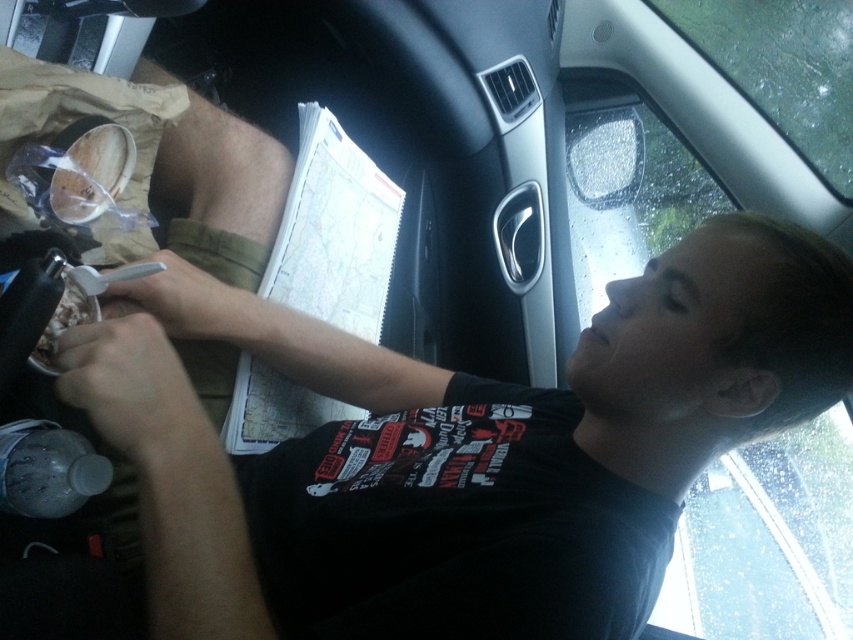
Question: Which of the following is the farthest from the observer?

Choices:
 (A) transparent glass windshield at upper right
 (B) transparent glass car window at upper right

Answer: (B)

Question: Which object appears closest to the camera in this image?

Choices:
 (A) transparent glass car window at upper right
 (B) transparent glass windshield at upper right

Answer: (B)

Question: Does transparent glass car window at upper right appear over transparent glass windshield at upper right?

Choices:
 (A) no
 (B) yes

Answer: (A)

Question: Considering the relative positions of transparent glass car window at upper right and transparent glass windshield at upper right in the image provided, where is transparent glass car window at upper right located with respect to transparent glass windshield at upper right?

Choices:
 (A) left
 (B) right

Answer: (A)

Question: Can you confirm if transparent glass car window at upper right is positioned above transparent glass windshield at upper right?

Choices:
 (A) yes
 (B) no

Answer: (B)

Question: Which object appears farthest from the camera in this image?

Choices:
 (A) transparent glass car window at upper right
 (B) transparent glass windshield at upper right

Answer: (A)